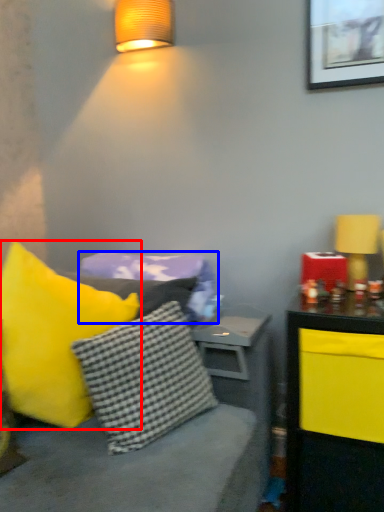
Question: Among these objects, which one is farthest to the camera, pillow (highlighted by a red box) or pillow (highlighted by a blue box)?

Choices:
 (A) pillow
 (B) pillow

Answer: (B)